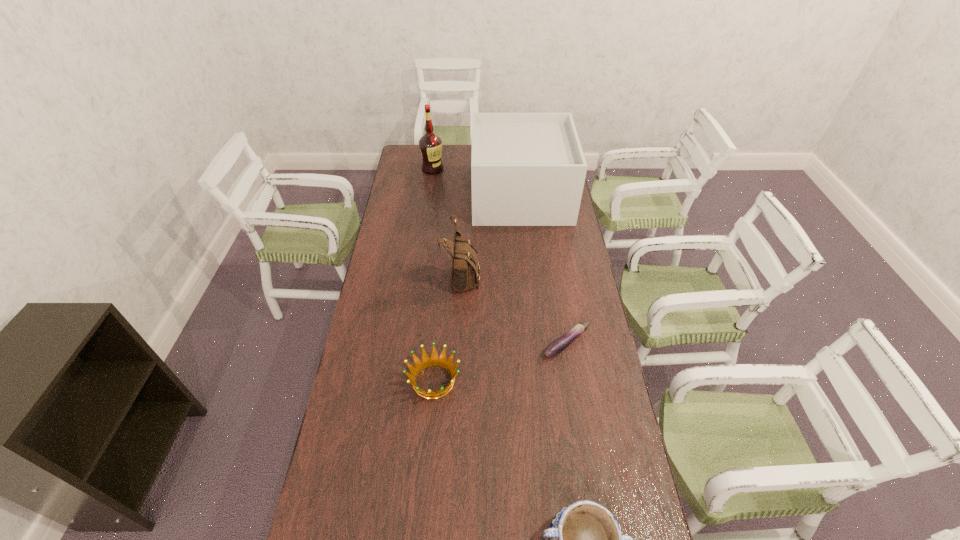
This screenshot has width=960, height=540. In order to click on empty location between the third farthest object and the shortest object in this screenshot , I will do `click(514, 309)`.

Image resolution: width=960 pixels, height=540 pixels. Find the location of `free area in between the box and the shoulder bag`. free area in between the box and the shoulder bag is located at coordinates (492, 235).

Identify the location of vacant point located between the fourth nearest object and the box. Image resolution: width=960 pixels, height=540 pixels. (492, 235).

At what (x,y) coordinates should I click in order to perform the action: click on free space between the shoulder bag and the alcohol. Please return your answer as a coordinate pair (x, y). Image resolution: width=960 pixels, height=540 pixels. Looking at the image, I should click on (447, 222).

What are the coordinates of `unoccupied area between the crown and the shortest object` in the screenshot? It's located at (500, 362).

What are the coordinates of `the closest object to the third shortest object` in the screenshot? It's located at (434, 360).

Point out which object is positioned as the fourth nearest to the fourth tallest object. Please provide its 2D coordinates. Your answer should be formatted as a tuple, i.e. [(x, y)], where the tuple contains the x and y coordinates of a point satisfying the conditions above.

[(527, 169)]

The width and height of the screenshot is (960, 540). In order to click on vacant area in the image that satisfies the following two spatial constraints: 1. on the label of the second shortest object; 2. on the right side of the alcohol in this screenshot , I will do `click(404, 381)`.

At what (x,y) coordinates should I click in order to perform the action: click on blank space that satisfies the following two spatial constraints: 1. on the label of the shortest object; 2. on the right side of the alcohol. Please return your answer as a coordinate pair (x, y). This screenshot has width=960, height=540. Looking at the image, I should click on (409, 344).

Locate an element on the screen. The height and width of the screenshot is (540, 960). vacant position in the image that satisfies the following two spatial constraints: 1. on the front-facing side of the shortest object; 2. on the right side of the shoulder bag is located at coordinates (459, 344).